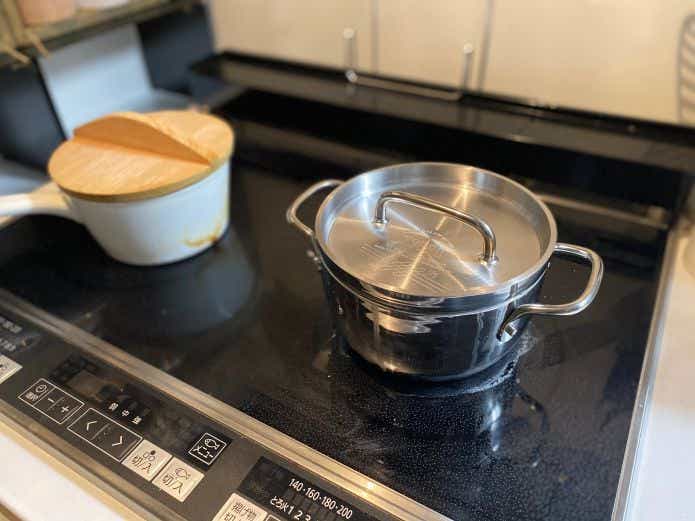
Where is `spice jars`? spice jars is located at coordinates (58, 10).